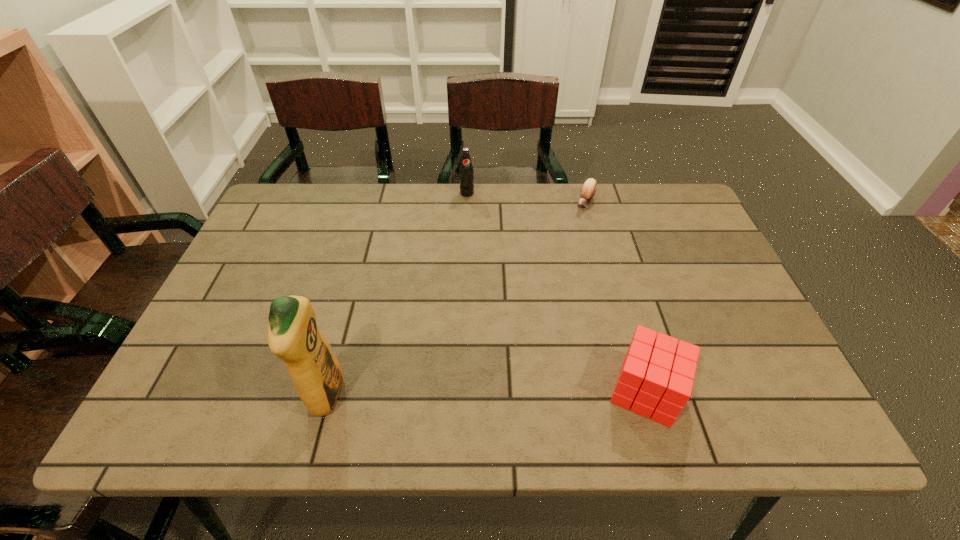
The width and height of the screenshot is (960, 540). I want to click on free space on the desktop that is between the leftmost object and the cube and is positioned on the front-facing side of the shortest object, so click(x=460, y=394).

The height and width of the screenshot is (540, 960). Find the location of `vacant space on the desktop that is between the leftmost object and the second shortest object and is positioned on the front label of the third object from right to left`. vacant space on the desktop that is between the leftmost object and the second shortest object and is positioned on the front label of the third object from right to left is located at coordinates (520, 393).